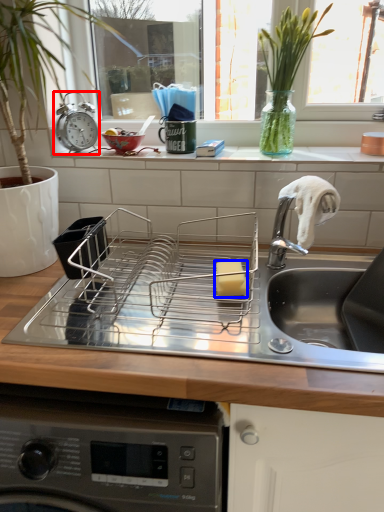
Question: Which of the following is the farthest to the observer, alarm clock (highlighted by a red box) or food (highlighted by a blue box)?

Choices:
 (A) alarm clock
 (B) food

Answer: (A)